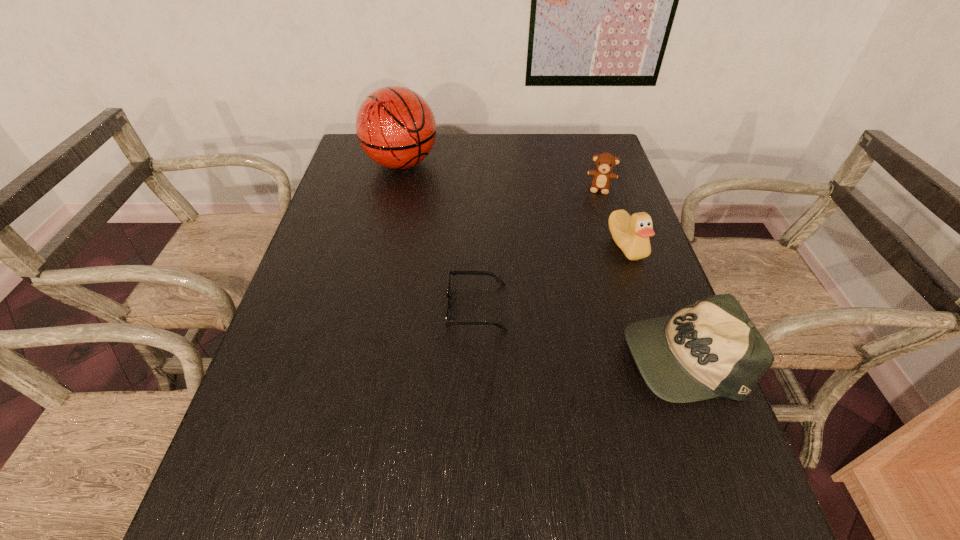
You are a GUI agent. You are given a task and a screenshot of the screen. Output one action in this format:
    pyautogui.click(x=<x>, y=<y>)
    Task: Click on the free space located 0.320m at the beak of the third nearest object
    This screenshot has width=960, height=540.
    Given the screenshot: What is the action you would take?
    (x=571, y=350)

At what (x,y) coordinates should I click in order to perform the action: click on blank space located 0.320m at the beak of the third nearest object. Please return your answer as a coordinate pair (x, y). Looking at the image, I should click on (571, 350).

Locate an element on the screen. The height and width of the screenshot is (540, 960). object that is positioned at the far edge is located at coordinates (395, 126).

Find the location of a particular element. This screenshot has height=540, width=960. object that is at the left edge is located at coordinates (395, 126).

This screenshot has width=960, height=540. Find the location of `baseball cap present at the right edge`. baseball cap present at the right edge is located at coordinates (711, 348).

Locate an element on the screen. The height and width of the screenshot is (540, 960). teddy bear located at the right edge is located at coordinates (605, 162).

The image size is (960, 540). I want to click on duck at the right edge, so click(x=631, y=233).

Image resolution: width=960 pixels, height=540 pixels. In order to click on object that is at the far left corner in this screenshot , I will do `click(395, 126)`.

Identify the location of free space at the far edge of the desktop. This screenshot has height=540, width=960. (473, 138).

This screenshot has width=960, height=540. In the image, there is a desktop. In order to click on vacant space at the right edge in this screenshot , I will do `click(649, 311)`.